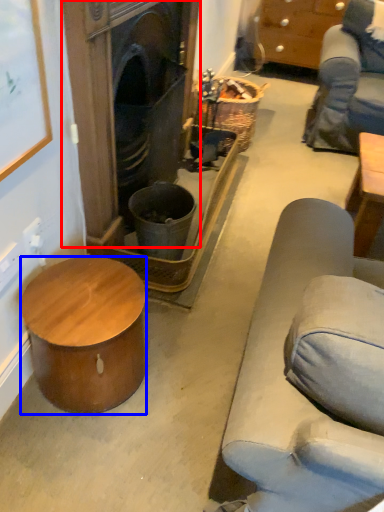
Question: Which point is further to the camera, fireplace (highlighted by a red box) or desk (highlighted by a blue box)?

Choices:
 (A) fireplace
 (B) desk

Answer: (A)